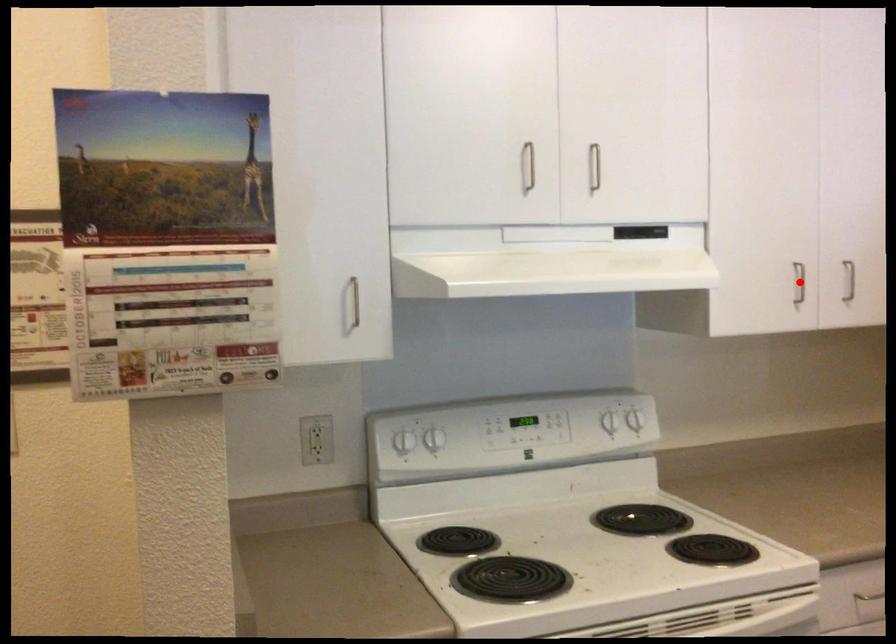
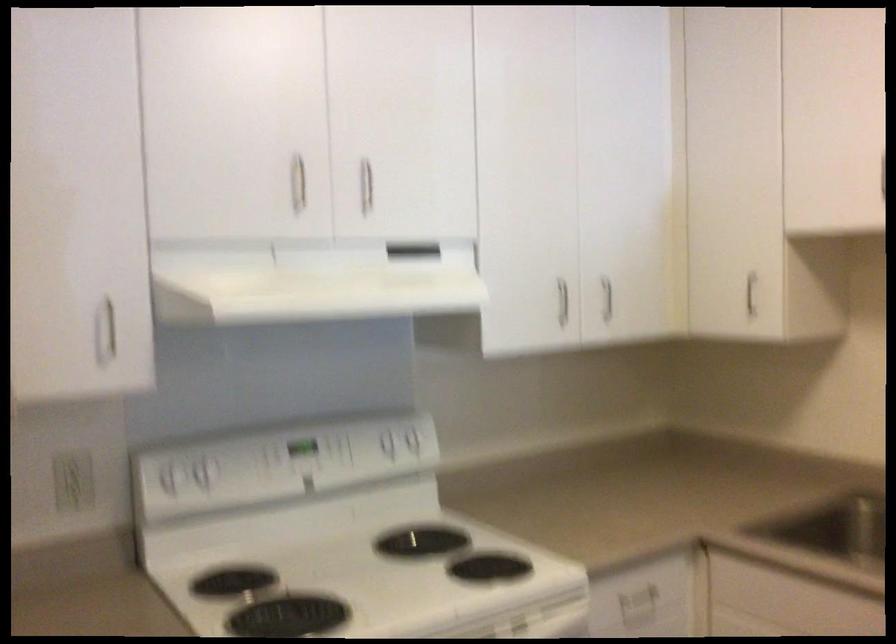
In the second image, find the point that corresponds to the highlighted location in the first image.

(562, 301)